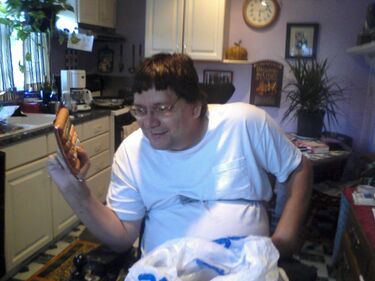
This screenshot has height=281, width=375. I want to click on black flower pot, so click(x=313, y=121).